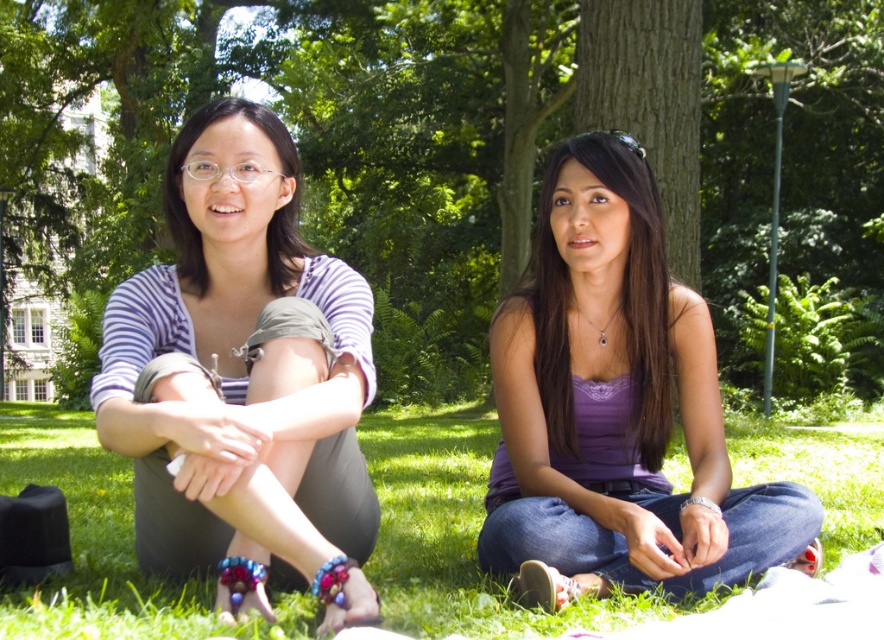
Question: Among these objects, which one is nearest to the camera?

Choices:
 (A) purple fabric tank top at center
 (B) brown textured tree at center
 (C) striped fabric shirt at left

Answer: (C)

Question: Which object is farther from the camera taking this photo?

Choices:
 (A) brown textured tree at center
 (B) striped fabric shirt at left
 (C) purple satin top at center
 (D) purple fabric tank top at center

Answer: (A)

Question: Considering the relative positions of purple fabric tank top at center and purple satin top at center in the image provided, where is purple fabric tank top at center located with respect to purple satin top at center?

Choices:
 (A) below
 (B) above

Answer: (A)

Question: Can you confirm if striped fabric shirt at left is wider than purple satin top at center?

Choices:
 (A) no
 (B) yes

Answer: (B)

Question: Considering the relative positions of purple satin top at center and matte purple blouse at left in the image provided, where is purple satin top at center located with respect to matte purple blouse at left?

Choices:
 (A) below
 (B) above

Answer: (A)

Question: Which object appears closest to the camera in this image?

Choices:
 (A) purple fabric tank top at center
 (B) brown textured tree at center
 (C) purple satin top at center

Answer: (A)